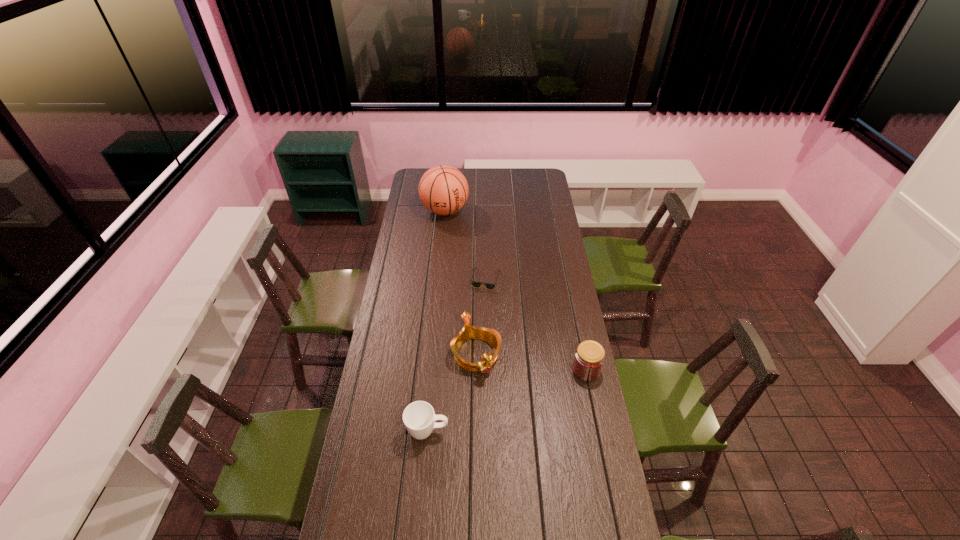
The height and width of the screenshot is (540, 960). Find the location of `cup`. cup is located at coordinates (419, 418).

Where is `the rightmost object`? The width and height of the screenshot is (960, 540). the rightmost object is located at coordinates (589, 357).

Find the location of a particular element. the fourth nearest object is located at coordinates (475, 284).

Image resolution: width=960 pixels, height=540 pixels. I want to click on sunglasses, so click(475, 284).

What are the coordinates of `basketball` in the screenshot? It's located at (443, 190).

You are a GUI agent. You are given a task and a screenshot of the screen. Output one action in this format:
    pyautogui.click(x=<x>, y=<y>)
    Task: Click on the tallest object
    
    Given the screenshot: What is the action you would take?
    pyautogui.click(x=443, y=190)

This screenshot has width=960, height=540. Find the location of `tiara`. tiara is located at coordinates (491, 336).

The image size is (960, 540). What are the coordinates of `vacant space situated with the handle on the side of the nearest object` in the screenshot? It's located at (527, 431).

The image size is (960, 540). I want to click on free point located on the back of the jam, so click(x=576, y=319).

Where is `free location located 0.230m on the lenses of the shortest object`? The width and height of the screenshot is (960, 540). free location located 0.230m on the lenses of the shortest object is located at coordinates (505, 325).